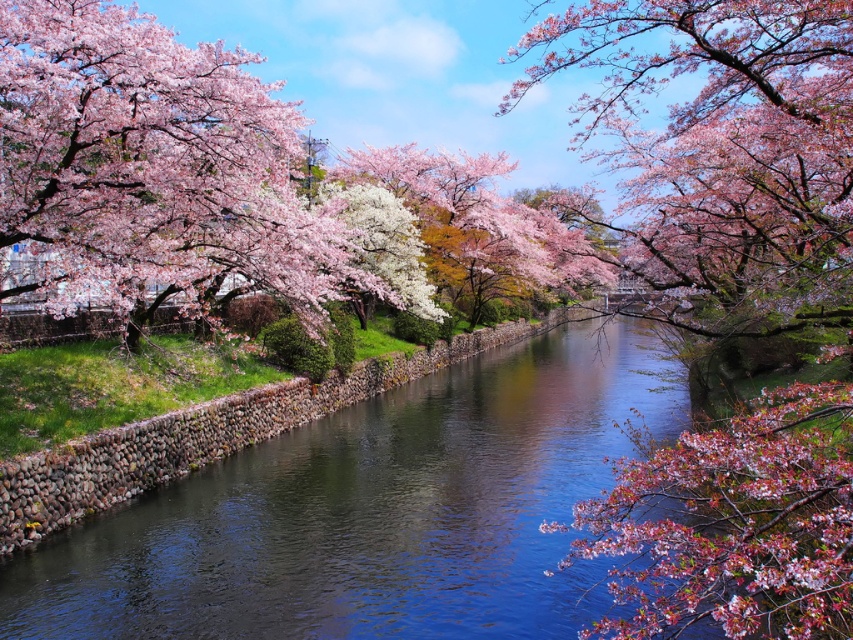
Question: Can you confirm if pink blossoms at center is positioned below clear water at center?

Choices:
 (A) no
 (B) yes

Answer: (A)

Question: Is pink blossoms at center positioned in front of clear water at center?

Choices:
 (A) no
 (B) yes

Answer: (B)

Question: Which of the following is the farthest from the observer?

Choices:
 (A) (370, 426)
 (B) (822, 560)

Answer: (A)

Question: In this image, where is pink blossoms at center located relative to clear water at center?

Choices:
 (A) right
 (B) left

Answer: (A)

Question: Which point is closer to the camera?

Choices:
 (A) (686, 452)
 (B) (486, 552)

Answer: (A)

Question: Which point is farther to the camera?

Choices:
 (A) pink blossoms at center
 (B) clear water at center

Answer: (B)